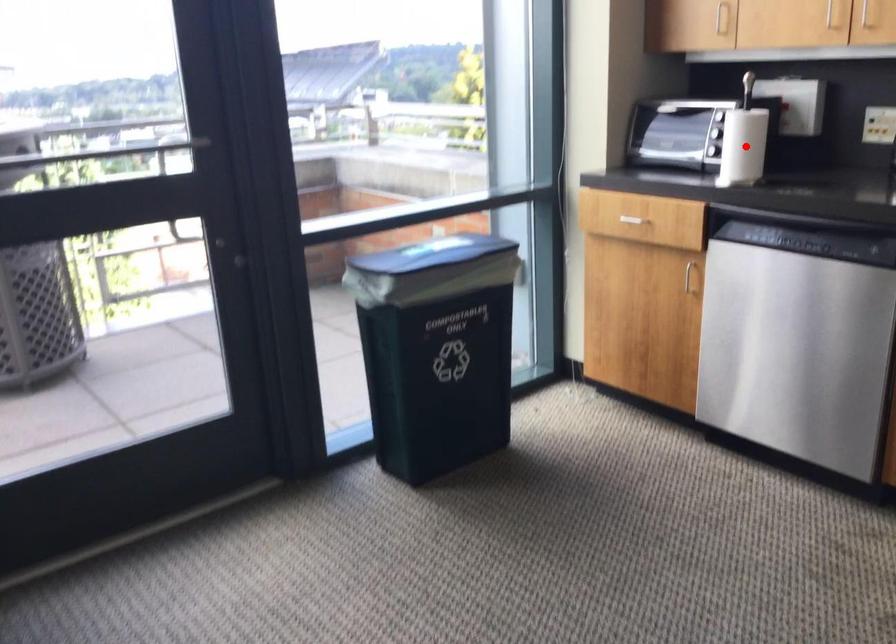
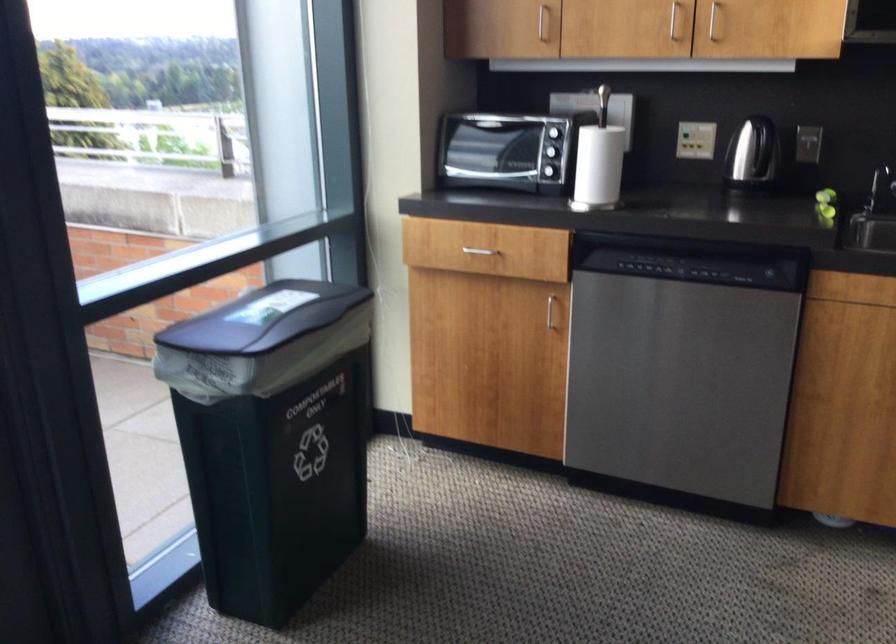
Where in the second image is the point corresponding to the highlighted location from the first image?

(599, 165)